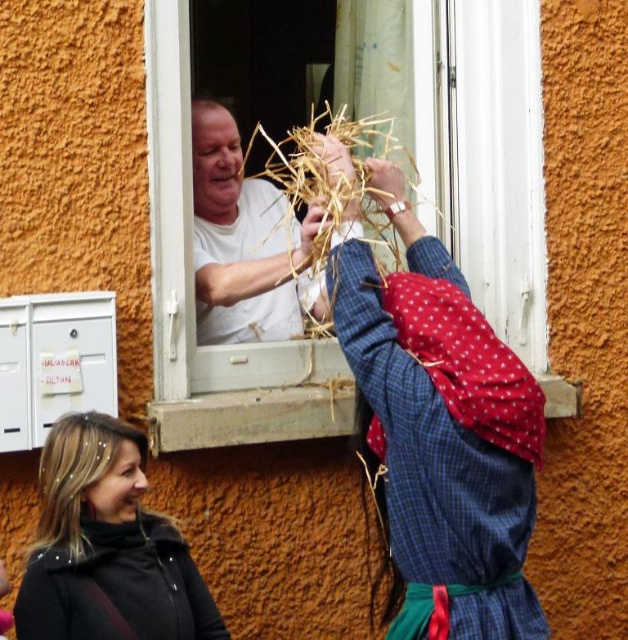
Does black leather jacket at lower left have a greater width compared to white matte shirt at upper center?

Yes, black leather jacket at lower left is wider than white matte shirt at upper center.

The image size is (628, 640). What do you see at coordinates (106, 547) in the screenshot?
I see `black leather jacket at lower left` at bounding box center [106, 547].

The width and height of the screenshot is (628, 640). I want to click on black leather jacket at lower left, so [x=106, y=547].

Is white plastic window at center to the left of black leather jacket at lower left from the viewer's perspective?

Incorrect, white plastic window at center is not on the left side of black leather jacket at lower left.

Which of these two, white plastic window at center or black leather jacket at lower left, stands shorter?

Standing shorter between the two is black leather jacket at lower left.

What are the coordinates of `white plastic window at center` in the screenshot? It's located at (489, 164).

Does white plastic window at center have a lesser width compared to white matte shirt at upper center?

No.

Does white plastic window at center have a lesser height compared to white matte shirt at upper center?

Incorrect, white plastic window at center's height does not fall short of white matte shirt at upper center's.

Describe the element at coordinates (489, 164) in the screenshot. Image resolution: width=628 pixels, height=640 pixels. I see `white plastic window at center` at that location.

The height and width of the screenshot is (640, 628). Find the location of `white plastic window at center`. white plastic window at center is located at coordinates (489, 164).